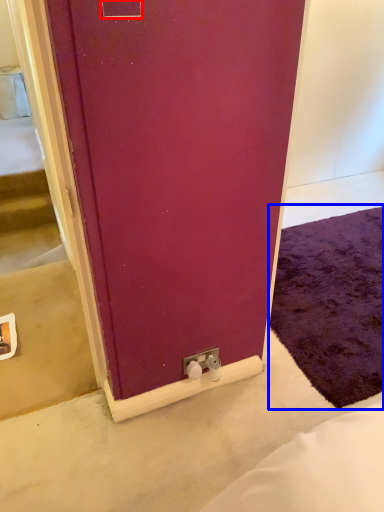
Question: Which point is closer to the camera, electric outlet (highlighted by a red box) or doormat (highlighted by a blue box)?

Choices:
 (A) electric outlet
 (B) doormat

Answer: (A)